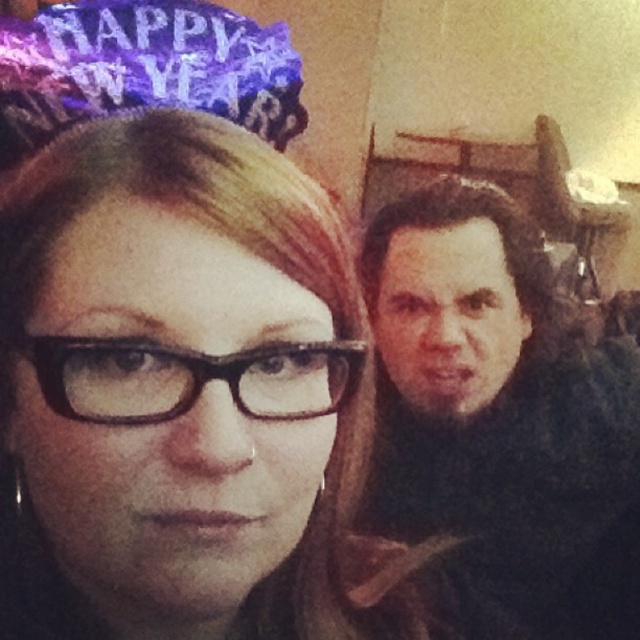
Who is lower down, matte black glasses at center or dark brown fur at right?

dark brown fur at right is below.

Between point (115, 394) and point (600, 372), which one is positioned in front?

Positioned in front is point (115, 394).

Which is in front, point (212, 445) or point (468, 563)?

Positioned in front is point (212, 445).

Identify the location of matte black glasses at center. This screenshot has height=640, width=640. [186, 394].

Is matte black glasses at center shorter than black plastic glasses at center?

Incorrect, matte black glasses at center's height does not fall short of black plastic glasses at center's.

Find the location of a particular element. This screenshot has width=640, height=640. matte black glasses at center is located at coordinates (186, 394).

Which is in front, point (93, 486) or point (51, 353)?

Point (51, 353)

Locate an element on the screen. Image resolution: width=640 pixels, height=640 pixels. matte black glasses at center is located at coordinates (186, 394).

Does dark brown fur at right appear on the left side of black plastic glasses at center?

In fact, dark brown fur at right is to the right of black plastic glasses at center.

Can you confirm if dark brown fur at right is wider than black plastic glasses at center?

Indeed, dark brown fur at right has a greater width compared to black plastic glasses at center.

Is point (456, 464) positioned before point (291, 406)?

No, it is behind (291, 406).

Where is `dark brown fur at right`? dark brown fur at right is located at coordinates (500, 422).